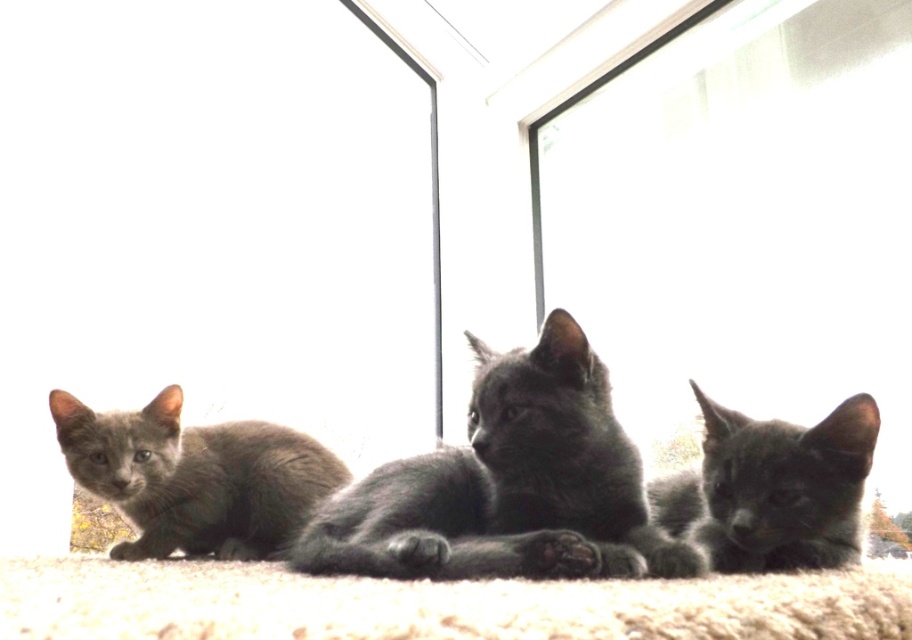
You are a delivery person trying to enter the house through the transparent glass screen door at left. The soft gray fur cat at center is blocking your path. Can you open the door without moving the cat?

The transparent glass screen door at left is bigger than the soft gray fur cat at center, so you can open the door without moving the cat because the door is larger and can be operated around the cat.

You are a delivery person holding a package that needs to be placed on a table exactly 2 meters away from the transparent glass screen door at left. Is the camera a suitable spot for placing the package?

The transparent glass screen door at left and camera are 1.96 meters apart. Since the required distance is 2 meters, the camera is just slightly closer than needed, so it might not be suitable for placing the package.